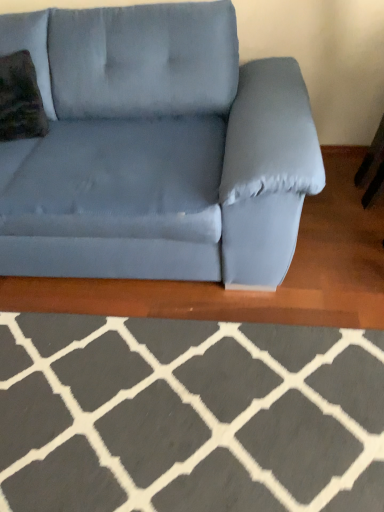
Question: Is velvety green throw pillow at upper left situated inside gray wool rug at lower center or outside?

Choices:
 (A) outside
 (B) inside

Answer: (A)

Question: In terms of width, does velvety green throw pillow at upper left look wider or thinner when compared to gray wool rug at lower center?

Choices:
 (A) wide
 (B) thin

Answer: (B)

Question: Which is farther from the velvety green throw pillow at upper left?

Choices:
 (A) suede blue couch at center
 (B) gray wool rug at lower center

Answer: (B)

Question: Based on their relative distances, which object is nearer to the gray wool rug at lower center?

Choices:
 (A) suede blue couch at center
 (B) velvety green throw pillow at upper left

Answer: (A)